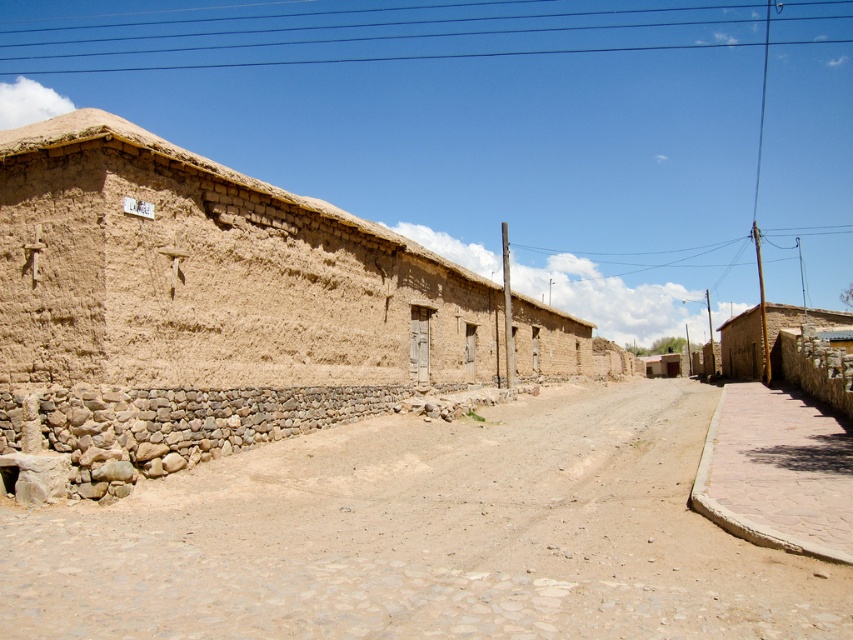
Does brown dirt track at center have a smaller size compared to smooth concrete alley at lower right?

No.

Who is higher up, brown dirt track at center or smooth concrete alley at lower right?

smooth concrete alley at lower right

Which is in front, point (663, 628) or point (809, 444)?

Point (663, 628) is more forward.

Locate an element on the screen. The width and height of the screenshot is (853, 640). brown dirt track at center is located at coordinates (425, 536).

Is brown mud hut at left in front of smooth concrete alley at lower right?

No.

Who is positioned more to the left, brown mud hut at left or smooth concrete alley at lower right?

brown mud hut at left

Does point (293, 280) come closer to viewer compared to point (779, 540)?

No, it is not.

This screenshot has width=853, height=640. Identify the location of brown mud hut at left. coord(213,275).

Is point (204, 477) more distant than point (770, 346)?

No, (204, 477) is closer to viewer.

Between point (55, 589) and point (775, 369), which one is positioned behind?

The point (775, 369) is behind.

Identify the location of brown dirt track at center. Image resolution: width=853 pixels, height=640 pixels. (425, 536).